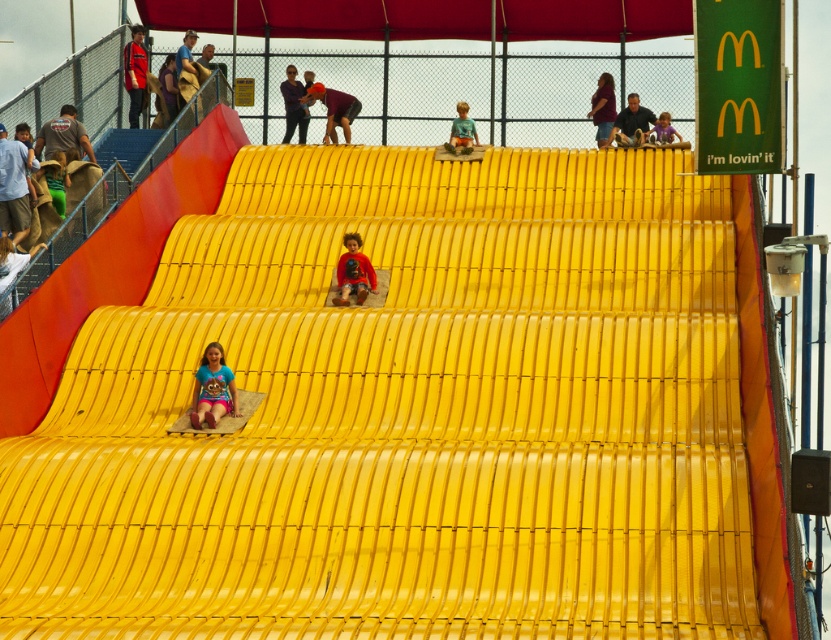
Between matte yellow slide at center and matte purple shirt at upper center, which one appears on the left side from the viewer's perspective?

matte yellow slide at center

Is point (362, 260) positioned behind point (597, 93)?

No.

Does point (342, 262) lie in front of point (603, 140)?

Yes.

The height and width of the screenshot is (640, 831). In order to click on matte yellow slide at center in this screenshot , I will do `click(353, 272)`.

Between matte blue t-shirt at center and matte purple shirt at upper center, which one has less height?

Standing shorter between the two is matte blue t-shirt at center.

Is matte blue t-shirt at center taller than matte purple shirt at upper center?

Incorrect, matte blue t-shirt at center's height is not larger of matte purple shirt at upper center's.

Is point (203, 397) closer to camera compared to point (613, 116)?

Yes, point (203, 397) is in front of point (613, 116).

I want to click on matte blue t-shirt at center, so click(x=214, y=388).

Who is lower down, red shirt at upper left or matte black shirt at upper center?

red shirt at upper left is below.

Does red shirt at upper left have a greater width compared to matte black shirt at upper center?

Incorrect, red shirt at upper left's width does not surpass matte black shirt at upper center's.

The height and width of the screenshot is (640, 831). What are the coordinates of `red shirt at upper left` in the screenshot? It's located at (134, 72).